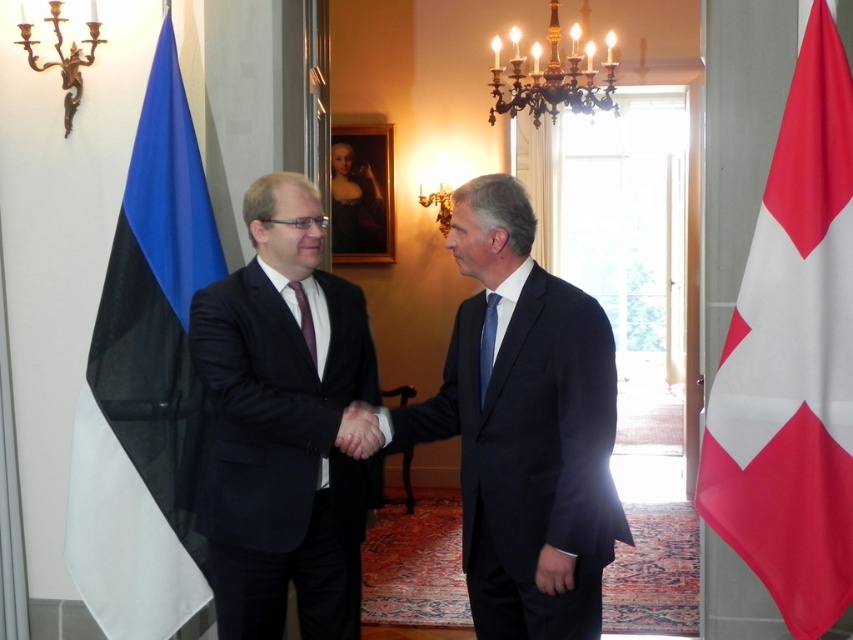
Question: Can you confirm if black fabric flag at left is smaller than blue silk tie at center?

Choices:
 (A) no
 (B) yes

Answer: (A)

Question: Among these points, which one is nearest to the camera?

Choices:
 (A) (492, 349)
 (B) (505, 257)
 (C) (200, 227)
 (D) (772, 257)

Answer: (B)

Question: Where is white fabric flag at right located in relation to black fabric flag at left in the image?

Choices:
 (A) right
 (B) left

Answer: (A)

Question: Estimate the real-world distances between objects in this image. Which object is farther from the black fabric flag at left?

Choices:
 (A) dark blue suit at center
 (B) white fabric flag at right
 (C) purple satin tie at center

Answer: (B)

Question: Among these points, which one is nearest to the camera?

Choices:
 (A) (138, 452)
 (B) (491, 330)
 (C) (788, 618)

Answer: (B)

Question: Considering the relative positions of blue silk tie at center and purple satin tie at center in the image provided, where is blue silk tie at center located with respect to purple satin tie at center?

Choices:
 (A) right
 (B) left

Answer: (A)